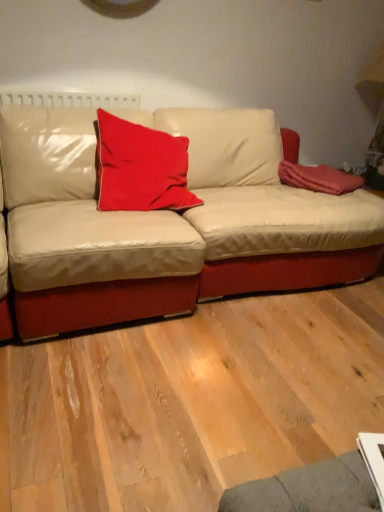
Question: Should I look upward or downward to see red velvet cushion at center?

Choices:
 (A) up
 (B) down

Answer: (A)